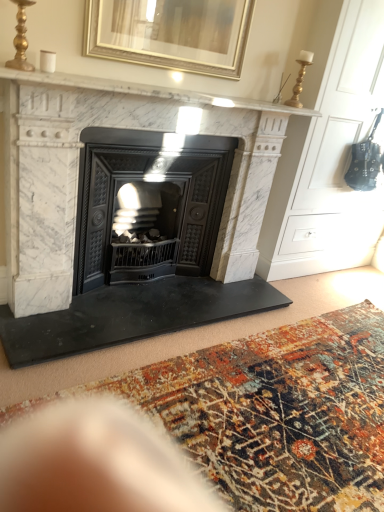
At what (x,y) coordinates should I click in order to perform the action: click on white marble fireplace at center. Please return your answer as a coordinate pair (x, y). This screenshot has width=384, height=512. Looking at the image, I should click on (78, 162).

Locate an element on the screen. The width and height of the screenshot is (384, 512). gold metallic picture frame at upper center is located at coordinates (171, 34).

You are a GUI agent. You are given a task and a screenshot of the screen. Output one action in this format:
    pyautogui.click(x=<x>, y=<y>)
    Task: Click on the black cast iron wood burning stove at center
    This screenshot has height=512, width=384.
    Given the screenshot: What is the action you would take?
    pyautogui.click(x=148, y=205)

The width and height of the screenshot is (384, 512). I want to click on multicolored woven rug at center, so click(x=274, y=412).

Is point (25, 256) positioned behind point (218, 55)?

No, (25, 256) is in front of (218, 55).

Is white marble fireplace at center facing away from gold metallic picture frame at upper center?

That's not correct — white marble fireplace at center is not looking away from gold metallic picture frame at upper center.

From a real-world perspective, is white marble fireplace at center below gold metallic picture frame at upper center?

Correct, in the physical world, white marble fireplace at center is lower than gold metallic picture frame at upper center.

Can we say white marble fireplace at center lies outside gold metallic picture frame at upper center?

Yes.

Which point is more forward, (x=201, y=441) or (x=241, y=136)?

Positioned in front is point (x=201, y=441).

Do you think multicolored woven rug at center is within white marble fireplace at center, or outside of it?

multicolored woven rug at center cannot be found inside white marble fireplace at center.

Is multicolored woven rug at center to the right of white marble fireplace at center from the viewer's perspective?

Indeed, multicolored woven rug at center is positioned on the right side of white marble fireplace at center.

From a real-world perspective, between multicolored woven rug at center and white marble fireplace at upper center, who is vertically lower?

From a 3D spatial view, multicolored woven rug at center is below.

Which of these two, multicolored woven rug at center or white marble fireplace at upper center, is bigger?

multicolored woven rug at center.

Does multicolored woven rug at center appear on the right side of white marble fireplace at upper center?

Indeed, multicolored woven rug at center is positioned on the right side of white marble fireplace at upper center.

Is multicolored woven rug at center wider or thinner than white marble fireplace at upper center?

Considering their sizes, multicolored woven rug at center looks broader than white marble fireplace at upper center.

How many degrees apart are the facing directions of white marble fireplace at upper center and white marble fireplace at center?

0.000859 degrees.

From the image's perspective, which object appears higher, white marble fireplace at upper center or white marble fireplace at center?

white marble fireplace at upper center appears higher in the image.

Does white marble fireplace at upper center lie behind white marble fireplace at center?

No, it is in front of white marble fireplace at center.

Is white marble fireplace at center inside white marble fireplace at upper center?

No, white marble fireplace at center is not a part of white marble fireplace at upper center.

In the scene shown: Considering the relative sizes of black cast iron wood burning stove at center and white marble fireplace at center in the image provided, is black cast iron wood burning stove at center thinner than white marble fireplace at center?

Yes, black cast iron wood burning stove at center is thinner than white marble fireplace at center.

How many degrees apart are the facing directions of black cast iron wood burning stove at center and white marble fireplace at center?

0.000611 degrees.

Between black cast iron wood burning stove at center and white marble fireplace at center, which one appears on the right side from the viewer's perspective?

white marble fireplace at center is more to the right.

From the image's perspective, is black cast iron wood burning stove at center positioned above or below white marble fireplace at center?

black cast iron wood burning stove at center is situated lower than white marble fireplace at center in the image.

Considering the relative sizes of black cast iron wood burning stove at center and gold metallic picture frame at upper center in the image provided, is black cast iron wood burning stove at center thinner than gold metallic picture frame at upper center?

No, black cast iron wood burning stove at center is not thinner than gold metallic picture frame at upper center.

From a real-world perspective, between black cast iron wood burning stove at center and gold metallic picture frame at upper center, who is vertically lower?

black cast iron wood burning stove at center is physically lower.

Is gold metallic picture frame at upper center at the back of black cast iron wood burning stove at center?

No, black cast iron wood burning stove at center is not facing the opposite direction of gold metallic picture frame at upper center.

Would you say black cast iron wood burning stove at center is inside or outside gold metallic picture frame at upper center?

black cast iron wood burning stove at center cannot be found inside gold metallic picture frame at upper center.

From the picture: Is white marble fireplace at upper center oriented away from gold metallic picture frame at upper center?

No, white marble fireplace at upper center is not facing the opposite direction of gold metallic picture frame at upper center.

Is white marble fireplace at upper center in contact with gold metallic picture frame at upper center?

No, white marble fireplace at upper center is not with gold metallic picture frame at upper center.

From the image's perspective, which one is positioned lower, white marble fireplace at upper center or gold metallic picture frame at upper center?

From the image's view, white marble fireplace at upper center is below.

From the picture: From a real-world perspective, is white marble fireplace at upper center physically located above or below gold metallic picture frame at upper center?

white marble fireplace at upper center is below gold metallic picture frame at upper center.

Locate an element on the screen. The width and height of the screenshot is (384, 512). picture frame that is behind the white marble fireplace at center is located at coordinates (171, 34).

You are a GUI agent. You are given a task and a screenshot of the screen. Output one action in this format:
    pyautogui.click(x=<x>, y=<y>)
    Task: Click on the mat to the right of white marble fireplace at center
    
    Given the screenshot: What is the action you would take?
    pyautogui.click(x=274, y=412)

Which object lies nearer to the anchor point gold metallic picture frame at upper center, white marble fireplace at upper center or black cast iron wood burning stove at center?

white marble fireplace at upper center lies closer to gold metallic picture frame at upper center than the other object.

Looking at this image, from the image, which object appears to be nearer to multicolored woven rug at center, black cast iron wood burning stove at center or gold metallic picture frame at upper center?

black cast iron wood burning stove at center lies closer to multicolored woven rug at center than the other object.

Which object lies further to the anchor point black cast iron wood burning stove at center, white marble fireplace at upper center or white marble fireplace at center?

Based on the image, white marble fireplace at upper center appears to be further to black cast iron wood burning stove at center.

Estimate the real-world distances between objects in this image. Which object is further from gold metallic picture frame at upper center, multicolored woven rug at center or black cast iron wood burning stove at center?

multicolored woven rug at center is positioned further to the anchor gold metallic picture frame at upper center.

Considering their positions, is white marble fireplace at center positioned closer to gold metallic picture frame at upper center than multicolored woven rug at center?

white marble fireplace at center lies closer to gold metallic picture frame at upper center than the other object.

Which object lies further to the anchor point multicolored woven rug at center, white marble fireplace at upper center or black cast iron wood burning stove at center?

The object further to multicolored woven rug at center is white marble fireplace at upper center.

From the image, which object appears to be farther from white marble fireplace at upper center, multicolored woven rug at center or white marble fireplace at center?

multicolored woven rug at center is further to white marble fireplace at upper center.

Considering their positions, is gold metallic picture frame at upper center positioned further to multicolored woven rug at center than white marble fireplace at upper center?

gold metallic picture frame at upper center is positioned further to the anchor multicolored woven rug at center.

Where is `wood burning stove between gold metallic picture frame at upper center and multicolored woven rug at center in the up-down direction`? This screenshot has height=512, width=384. wood burning stove between gold metallic picture frame at upper center and multicolored woven rug at center in the up-down direction is located at coordinates (148, 205).

At what (x,y) coordinates should I click in order to perform the action: click on wood burning stove between white marble fireplace at center and multicolored woven rug at center from top to bottom. Please return your answer as a coordinate pair (x, y). This screenshot has height=512, width=384. Looking at the image, I should click on (148, 205).

Where is `mantle between gold metallic picture frame at upper center and white marble fireplace at center vertically`? This screenshot has height=512, width=384. mantle between gold metallic picture frame at upper center and white marble fireplace at center vertically is located at coordinates (148, 91).

Locate an element on the screen. The image size is (384, 512). fireplace that lies between white marble fireplace at upper center and black cast iron wood burning stove at center from top to bottom is located at coordinates (78, 162).